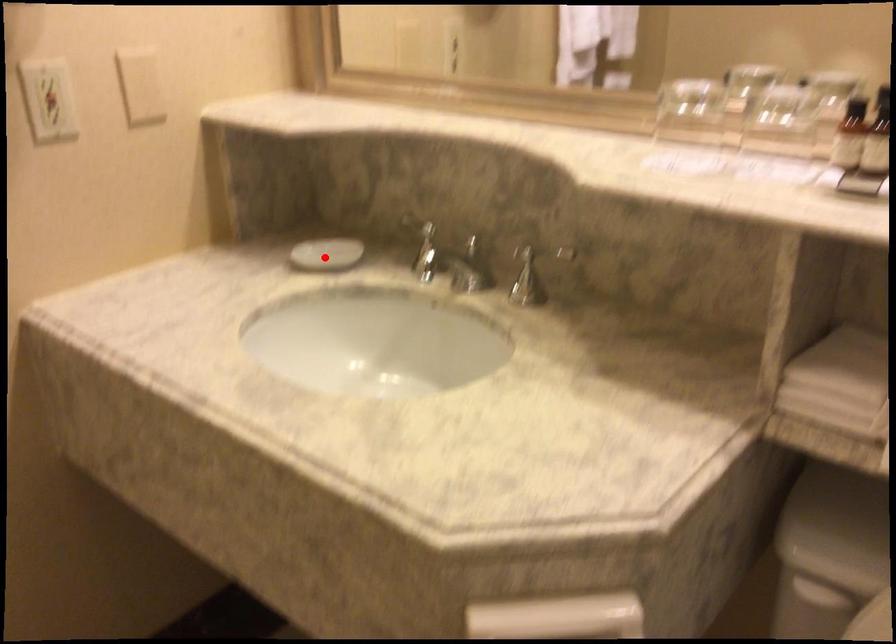
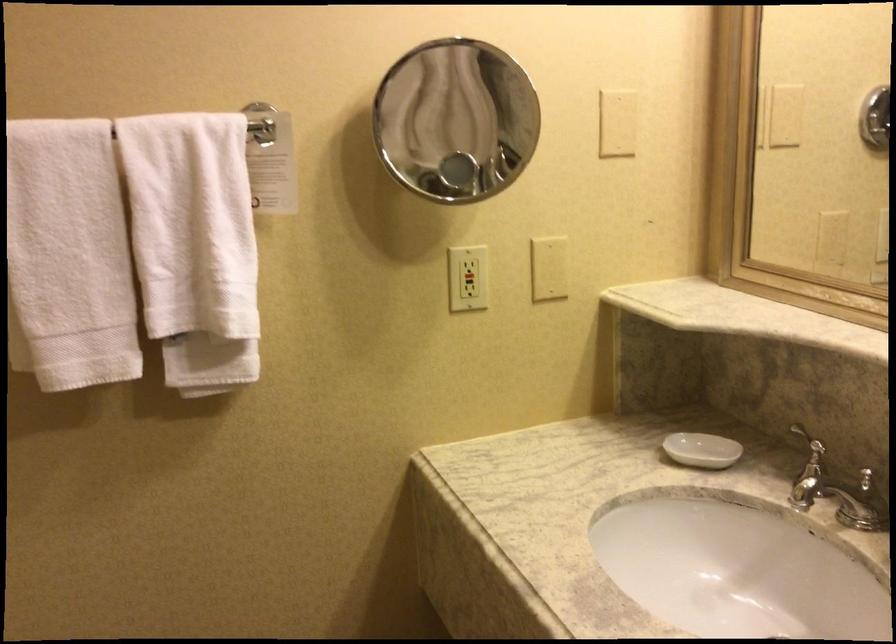
Question: I am providing you with two images of the same scene from different viewpoints. A red point is marked on the first image. Can you still see the location of the red point in image 2?

Choices:
 (A) Yes
 (B) No

Answer: (A)